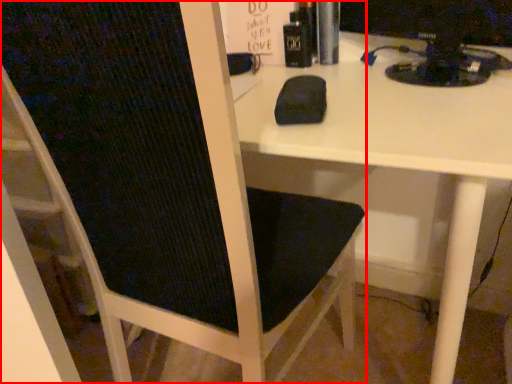
Question: From the image's perspective, what is the correct spatial positioning of chair (annotated by the red box) in reference to desktop computer?

Choices:
 (A) above
 (B) below

Answer: (B)